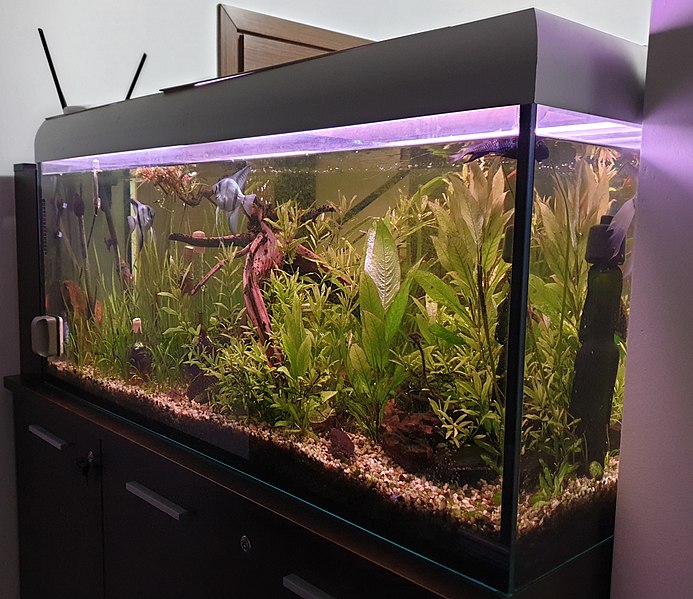
Find the location of a particular element. This screenshot has height=599, width=693. door is located at coordinates (269, 50).